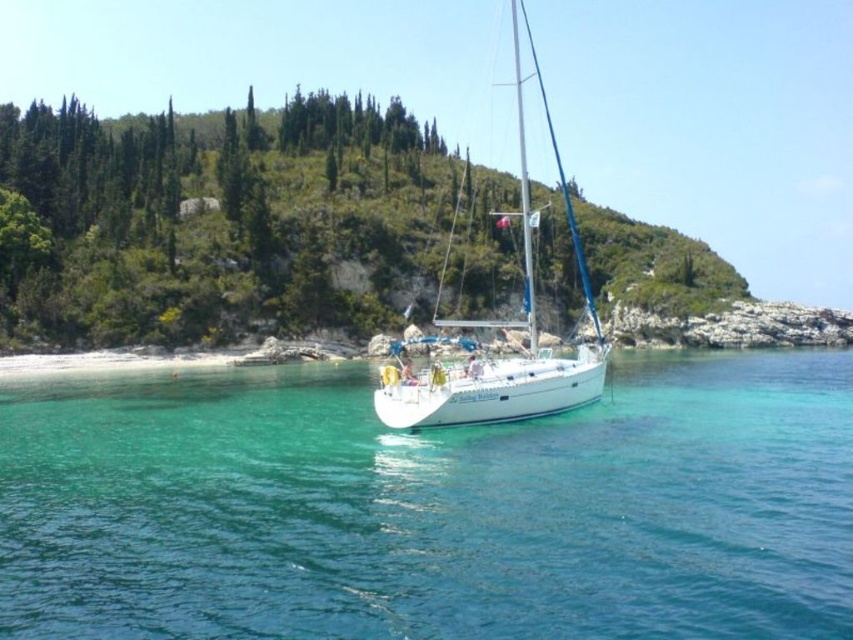
Question: Is clear blue water at center positioned before white glossy sailboat at center?

Choices:
 (A) yes
 (B) no

Answer: (A)

Question: Is clear blue water at center thinner than white glossy sailboat at center?

Choices:
 (A) no
 (B) yes

Answer: (A)

Question: Which point is farther from the camera taking this photo?

Choices:
 (A) (764, 556)
 (B) (421, 420)

Answer: (B)

Question: Is clear blue water at center closer to the viewer compared to white glossy sailboat at center?

Choices:
 (A) no
 (B) yes

Answer: (B)

Question: Which object appears farthest from the camera in this image?

Choices:
 (A) clear blue water at center
 (B) white glossy sailboat at center

Answer: (B)